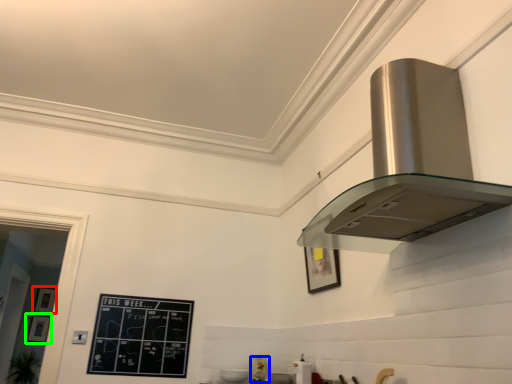
Question: Which object is positioned closest to picture frame (highlighted by a red box)? Select from appliance (highlighted by a blue box) and picture frame (highlighted by a green box).

Choices:
 (A) appliance
 (B) picture frame

Answer: (B)